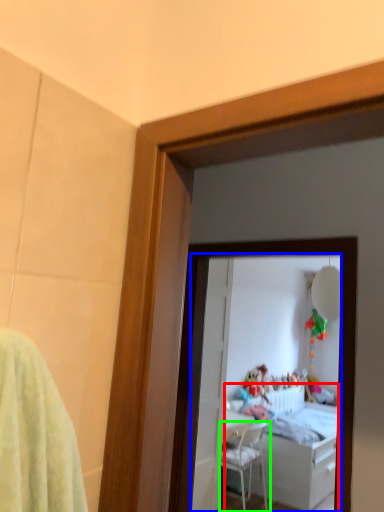
Question: Based on their relative distances, which object is farther from bed (highlighted by a red box)? Choose from mirror (highlighted by a blue box) and chair (highlighted by a green box).

Choices:
 (A) mirror
 (B) chair

Answer: (B)